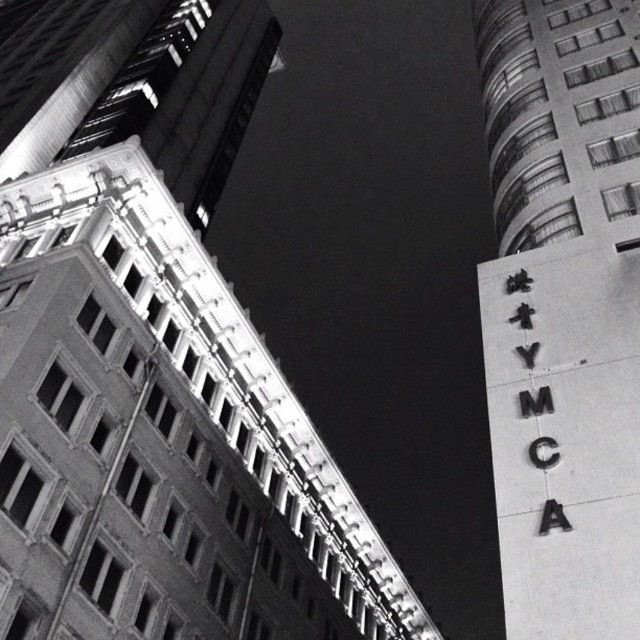
You are standing at the bottom of the image looking up at the two buildings. There is a point marked at coordinates (x=563, y=308). Which object does this point correspond to?

The point at coordinates (x=563, y=308) corresponds to the metallic ymca sign at upper right.

You are standing at the bottom of the image looking up at the two buildings. The metallic ymca sign at upper right is part of which building? Please answer based on its coordinates.

The metallic ymca sign at upper right is part of the modern building with curved design on the right because its coordinates at point (563,308) place it on the right side of the image.